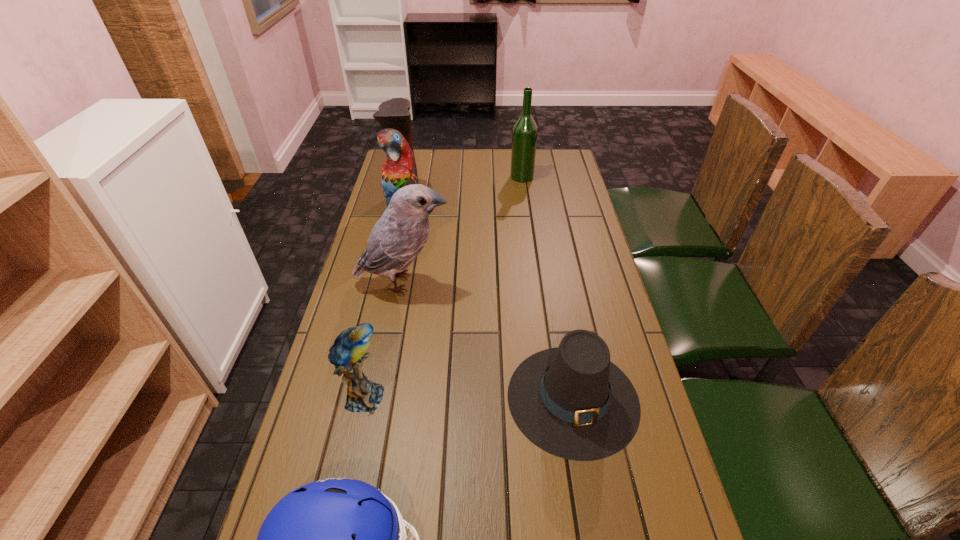
This screenshot has width=960, height=540. Identify the location of vacant position located 0.100m on the front-facing side of the shortest object. (593, 511).

Where is `object present at the far edge`? object present at the far edge is located at coordinates (524, 136).

I want to click on object at the right edge, so click(571, 401).

The image size is (960, 540). I want to click on vacant space at the far edge of the desktop, so click(x=506, y=177).

Image resolution: width=960 pixels, height=540 pixels. In order to click on vacant space at the left edge of the desktop in this screenshot , I will do 361,454.

The image size is (960, 540). In order to click on free space at the right edge of the desktop in this screenshot , I will do `click(641, 404)`.

Find the location of `vacant space at the far right corner`. vacant space at the far right corner is located at coordinates (567, 176).

At what (x,y) coordinates should I click in order to perform the action: click on free space that is in between the shortest parrot and the fourth nearest object. Please return your answer as a coordinate pair (x, y). Image resolution: width=960 pixels, height=540 pixels. Looking at the image, I should click on (384, 340).

Image resolution: width=960 pixels, height=540 pixels. What are the coordinates of `vacant area that lies between the third shortest object and the fifth nearest object` in the screenshot? It's located at (384, 301).

Locate an element on the screen. This screenshot has height=540, width=960. free space between the farthest object and the farthest parrot is located at coordinates (463, 192).